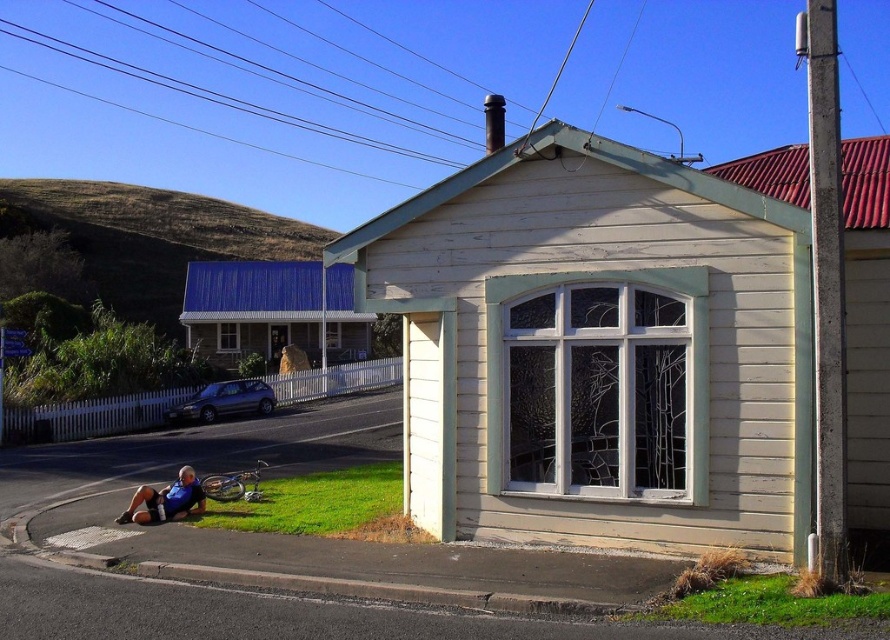
You are planning to install a new garden bed in the area between the green grass at lower right and the blue fabric shirt at lower left. Considering the height of the grass and the shirt, which one is shorter and would allow the garden bed to be placed without obstruction?

The green grass at lower right is shorter than the blue fabric shirt at lower left, so the garden bed can be placed near the green grass at lower right without obstruction.

You are standing in front of the building and want to lie down in the grass. Which direction should you move from the blue fabric shirt at lower left to reach the green grass at lower right?

The green grass at lower right is to the right of the blue fabric shirt at lower left, so you should move to the right to reach it.

You are planning to set up a picnic blanket in the rural scene. The picnic blanket is 1.2 meters wide. You see the green grass at lower left and the blue fabric shirt at lower left. Which area can accommodate the picnic blanket without overlapping the shirt?

The green grass at lower left has a greater width than the blue fabric shirt at lower left, so the picnic blanket can be placed on the green grass at lower left as it is wider and can accommodate the 1.2 meter wide blanket without overlapping the shirt.